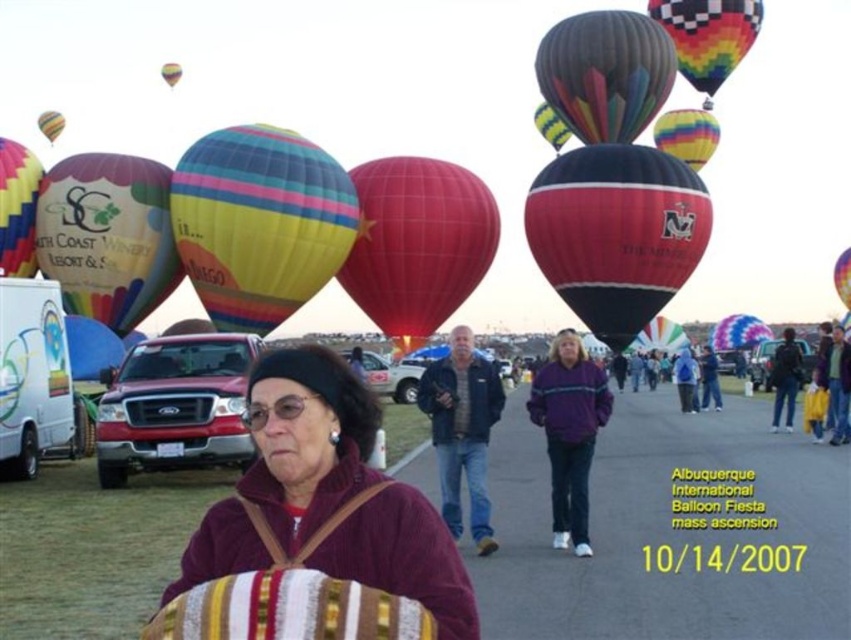
You are standing at the point marked at coordinates point (606, 284) and want to reach the nearest rest area. The rest area is located 130.94 meters away from your current position. If you walk at a speed of 1.5 meters per second, how many seconds will it take you to reach the rest area?

The distance to the rest area is 130.94 meters, and walking at 1.5 meters per second, it would take approximately 87.3 seconds to reach it.

You are a photographer at the Albuquerque International Balloon Fiesta. You want to capture a photo that includes both the matte yellow balloon at left and the rainbow striped balloon at upper right. Based on their positions, which balloon will appear closer to the camera in the photo?

The matte yellow balloon at left will appear closer to the camera in the photo because it is positioned in front of the rainbow striped balloon at upper right.